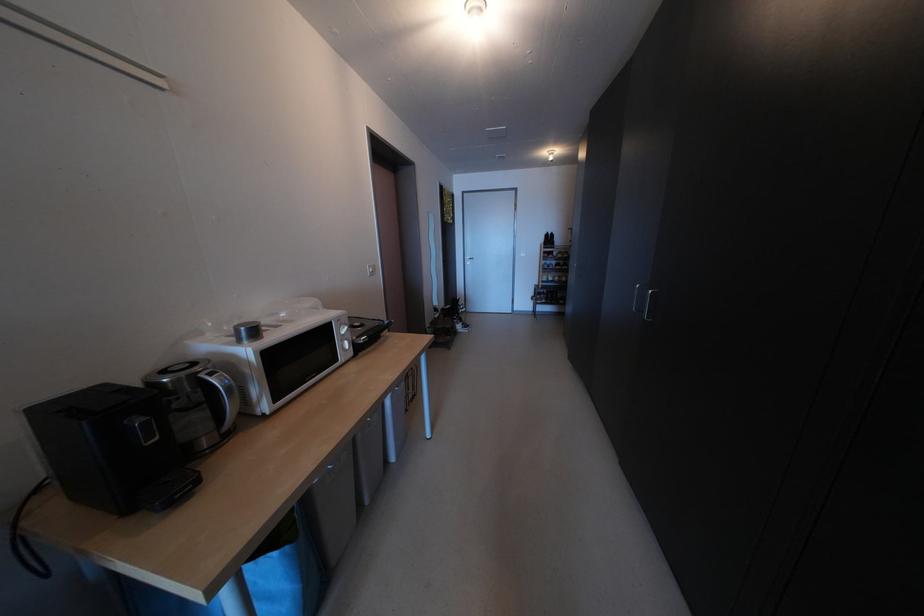
Image resolution: width=924 pixels, height=616 pixels. I want to click on white light switch, so click(x=371, y=270).